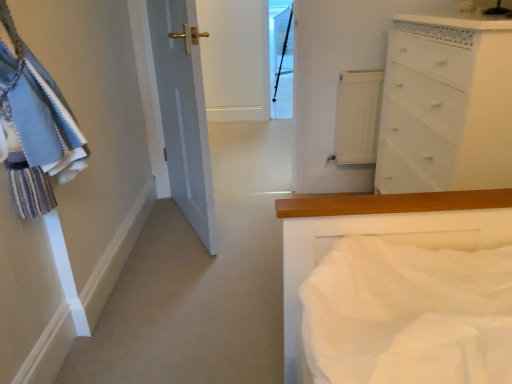
What is the approximate width of transparent glass door at upper center?

transparent glass door at upper center is 27.18 inches in width.

Image resolution: width=512 pixels, height=384 pixels. Find the location of `white painted wood chest of drawers at upper right`. white painted wood chest of drawers at upper right is located at coordinates (446, 106).

I want to click on transparent glass door at upper center, so click(x=281, y=61).

Is white painted wood chest of drawers at upper right wider than white wood radiator at upper center?

Indeed, white painted wood chest of drawers at upper right has a greater width compared to white wood radiator at upper center.

Is white painted wood chest of drawers at upper right outside of white wood radiator at upper center?

Indeed, white painted wood chest of drawers at upper right is completely outside white wood radiator at upper center.

Between white painted wood chest of drawers at upper right and white wood radiator at upper center, which one has larger size?

Bigger between the two is white painted wood chest of drawers at upper right.

Between transparent glass door at upper center and white painted wood chest of drawers at upper right, which one has more height?

Standing taller between the two is transparent glass door at upper center.

Could you tell me if transparent glass door at upper center is facing white painted wood chest of drawers at upper right?

No, transparent glass door at upper center is not turned towards white painted wood chest of drawers at upper right.

Which is closer, (x=279, y=68) or (x=487, y=28)?

The point (x=487, y=28) is closer to the camera.

Identify the location of glass door that is on the left side of white painted wood chest of drawers at upper right. The height and width of the screenshot is (384, 512). (281, 61).

Is white wood radiator at upper center wider than white painted wood chest of drawers at upper right?

In fact, white wood radiator at upper center might be narrower than white painted wood chest of drawers at upper right.

Could you measure the distance between white wood radiator at upper center and white painted wood chest of drawers at upper right?

The distance of white wood radiator at upper center from white painted wood chest of drawers at upper right is 16.09 inches.

Looking at the image, does white wood radiator at upper center seem bigger or smaller compared to white painted wood chest of drawers at upper right?

white wood radiator at upper center is smaller than white painted wood chest of drawers at upper right.

Is white painted wood chest of drawers at upper right next to transparent glass door at upper center and touching it?

No, white painted wood chest of drawers at upper right is not next to transparent glass door at upper center.

Who is more distant, white painted wood chest of drawers at upper right or transparent glass door at upper center?

transparent glass door at upper center is further away from the camera.

Would you say white painted wood chest of drawers at upper right is inside or outside transparent glass door at upper center?

The correct answer is: outside.

From a real-world perspective, is white painted wood chest of drawers at upper right located higher than transparent glass door at upper center?

Actually, white painted wood chest of drawers at upper right is physically below transparent glass door at upper center in the real world.

Is point (280, 114) closer to viewer compared to point (371, 115)?

No, it is not.

Are transparent glass door at upper center and white wood radiator at upper center beside each other?

transparent glass door at upper center and white wood radiator at upper center are not in contact.

From the image's perspective, which one is positioned lower, transparent glass door at upper center or white wood radiator at upper center?

white wood radiator at upper center appears lower in the image.

Find the location of a particular element. cabinetry that is in front of the transparent glass door at upper center is located at coordinates [358, 116].

Does white wood radiator at upper center have a smaller size compared to transparent glass door at upper center?

Indeed, white wood radiator at upper center has a smaller size compared to transparent glass door at upper center.

Is white wood radiator at upper center looking in the opposite direction of transparent glass door at upper center?

That's right, white wood radiator at upper center is facing away from transparent glass door at upper center.

Would you say white wood radiator at upper center is a long distance from transparent glass door at upper center?

Yes.

From the image's perspective, which object appears higher, white wood radiator at upper center or transparent glass door at upper center?

transparent glass door at upper center.

Identify the location of chest of drawers in front of the white wood radiator at upper center. (446, 106).

Identify the location of the chest of drawers that appears below the transparent glass door at upper center (from a real-world perspective). (446, 106).

Estimate the real-world distances between objects in this image. Which object is further from transparent glass door at upper center, white painted wood chest of drawers at upper right or white wood radiator at upper center?

white painted wood chest of drawers at upper right.

Which object lies further to the anchor point white painted wood chest of drawers at upper right, white wood radiator at upper center or transparent glass door at upper center?

transparent glass door at upper center is positioned further to the anchor white painted wood chest of drawers at upper right.

Which object lies nearer to the anchor point transparent glass door at upper center, white wood radiator at upper center or white painted wood chest of drawers at upper right?

Among the two, white wood radiator at upper center is located nearer to transparent glass door at upper center.

When comparing their distances from white painted wood chest of drawers at upper right, does transparent glass door at upper center or white wood radiator at upper center seem closer?

white wood radiator at upper center.

Estimate the real-world distances between objects in this image. Which object is closer to white wood radiator at upper center, white painted wood chest of drawers at upper right or transparent glass door at upper center?

white painted wood chest of drawers at upper right is closer to white wood radiator at upper center.

Based on their spatial positions, is transparent glass door at upper center or white painted wood chest of drawers at upper right closer to white wood radiator at upper center?

Based on the image, white painted wood chest of drawers at upper right appears to be nearer to white wood radiator at upper center.

Where is `cabinetry between white painted wood chest of drawers at upper right and transparent glass door at upper center from front to back`? cabinetry between white painted wood chest of drawers at upper right and transparent glass door at upper center from front to back is located at coordinates (358, 116).